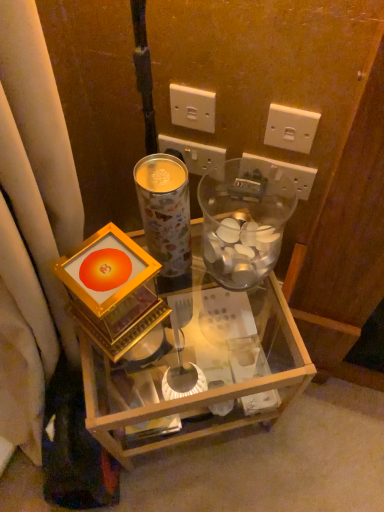
Question: Does white plastic power outlet at upper center, acting as the second power outlet starting from the left, have a smaller size compared to metallic floral-patterned coffee cup at center?

Choices:
 (A) no
 (B) yes

Answer: (B)

Question: Is white plastic power outlet at upper center, the 3th power outlet viewed from the right, positioned before metallic floral-patterned coffee cup at center?

Choices:
 (A) yes
 (B) no

Answer: (B)

Question: Is white plastic power outlet at upper center, acting as the second power outlet starting from the left, at the right side of metallic floral-patterned coffee cup at center?

Choices:
 (A) no
 (B) yes

Answer: (B)

Question: Can you confirm if white plastic power outlet at upper center, acting as the second power outlet starting from the left, is bigger than metallic floral-patterned coffee cup at center?

Choices:
 (A) yes
 (B) no

Answer: (B)

Question: Could you tell me if white plastic power outlet at upper center, the 3th power outlet viewed from the right, is facing metallic floral-patterned coffee cup at center?

Choices:
 (A) yes
 (B) no

Answer: (A)

Question: Considering the positions of white plastic power outlet at upper right, the fourth power outlet from the left, and white plastic power outlet at upper center, the 3th power outlet viewed from the right, in the image, is white plastic power outlet at upper right, the fourth power outlet from the left, taller or shorter than white plastic power outlet at upper center, the 3th power outlet viewed from the right,?

Choices:
 (A) short
 (B) tall

Answer: (A)

Question: Is white plastic power outlet at upper right, acting as the 1th power outlet starting from the right, wider or thinner than white plastic power outlet at upper center, the 3th power outlet viewed from the right?

Choices:
 (A) thin
 (B) wide

Answer: (A)

Question: Based on their sizes in the image, would you say white plastic power outlet at upper right, the fourth power outlet from the left, is bigger or smaller than white plastic power outlet at upper center, acting as the second power outlet starting from the left?

Choices:
 (A) small
 (B) big

Answer: (A)

Question: From a real-world perspective, is white plastic power outlet at upper right, acting as the 1th power outlet starting from the right, above or below white plastic power outlet at upper center, the 3th power outlet viewed from the right?

Choices:
 (A) below
 (B) above

Answer: (B)

Question: Considering the positions of black plastic power outlet at upper right, positioned as the second power outlet in right-to-left order, and transparent glass jar at center-right in the image, is black plastic power outlet at upper right, positioned as the second power outlet in right-to-left order, taller or shorter than transparent glass jar at center-right?

Choices:
 (A) short
 (B) tall

Answer: (A)

Question: In terms of width, does black plastic power outlet at upper right, the third power outlet from the left, look wider or thinner when compared to transparent glass jar at center-right?

Choices:
 (A) thin
 (B) wide

Answer: (A)

Question: From a real-world perspective, is black plastic power outlet at upper right, positioned as the second power outlet in right-to-left order, above or below transparent glass jar at center-right?

Choices:
 (A) above
 (B) below

Answer: (B)

Question: Is black plastic power outlet at upper right, positioned as the second power outlet in right-to-left order, inside or outside of transparent glass jar at center-right?

Choices:
 (A) inside
 (B) outside

Answer: (B)

Question: Is black plastic power outlet at upper right, the third power outlet from the left, situated inside metallic floral-patterned coffee cup at center or outside?

Choices:
 (A) outside
 (B) inside

Answer: (A)

Question: Visually, is black plastic power outlet at upper right, positioned as the second power outlet in right-to-left order, positioned to the left or to the right of metallic floral-patterned coffee cup at center?

Choices:
 (A) left
 (B) right

Answer: (B)